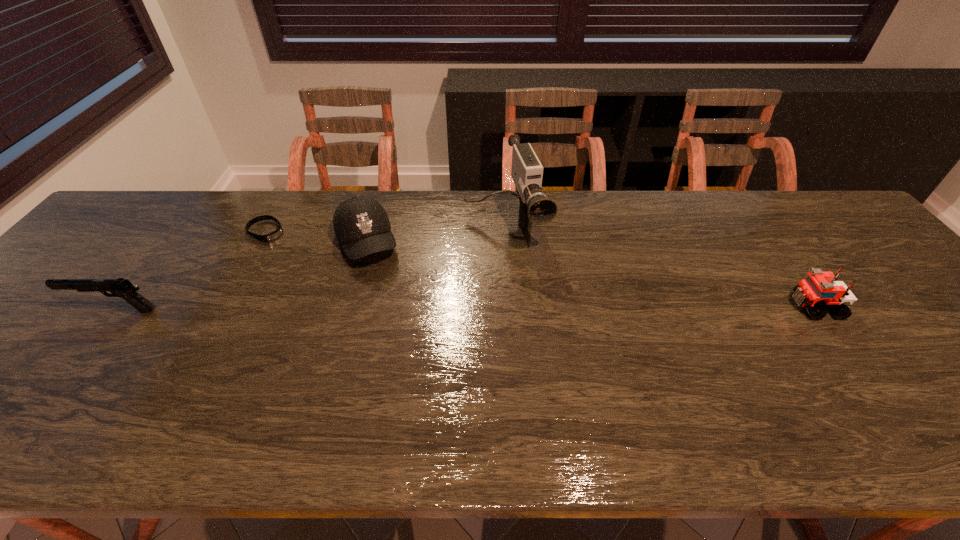
Identify the location of vacant space located 0.400m on the front-facing side of the rightmost object. The height and width of the screenshot is (540, 960). (630, 307).

The image size is (960, 540). I want to click on vacant area located 0.070m on the front-facing side of the rightmost object, so click(763, 307).

Find the location of `free space located on the front-facing side of the baseball cap`. free space located on the front-facing side of the baseball cap is located at coordinates (417, 367).

Locate an element on the screen. free spot located on the front-facing side of the baseball cap is located at coordinates (396, 319).

Identify the location of vacant space located 0.170m on the front-facing side of the baseball cap. The width and height of the screenshot is (960, 540). (394, 313).

At what (x,y) coordinates should I click in order to perform the action: click on free region located on the recording direction of the tallest object. Please return your answer as a coordinate pair (x, y). The image size is (960, 540). Looking at the image, I should click on (562, 382).

I want to click on vacant space located on the recording direction of the tallest object, so click(525, 283).

Where is `vacant region located 0.290m on the recording direction of the tallest object`? The height and width of the screenshot is (540, 960). vacant region located 0.290m on the recording direction of the tallest object is located at coordinates (546, 341).

Find the location of `vacant space located 0.170m on the display of the shortest object`. vacant space located 0.170m on the display of the shortest object is located at coordinates (314, 263).

The height and width of the screenshot is (540, 960). I want to click on blank space located on the display of the shortest object, so click(365, 299).